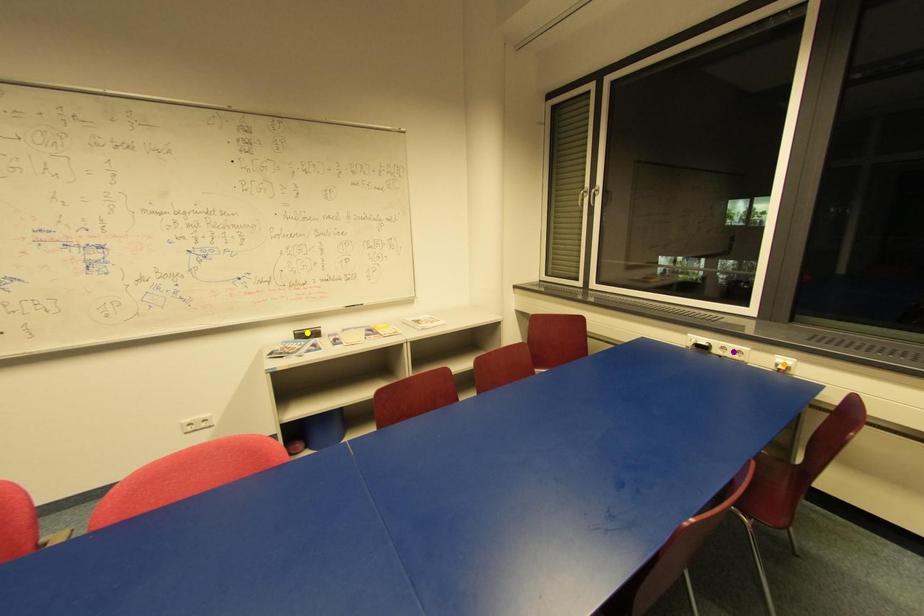
Order these from farthest to nearest:
A) purple point
B) orange point
C) yellow point

yellow point → purple point → orange point